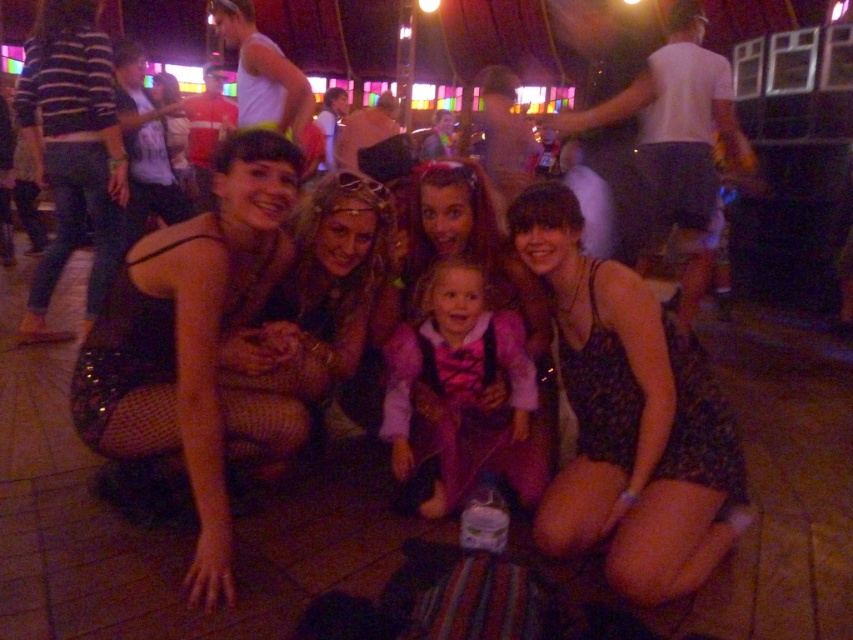
You are a photographer adjusting the camera focus for the group photo. The subjects include the matte black dress at center and the purple velvet dress at center. Which dress should you focus on first to ensure both are in sharp focus?

You should focus on the matte black dress at center first since it is closer to the viewer than the purple velvet dress at center. By focusing on the closer object, the depth of field may naturally include the farther one in acceptable focus.

You are a photographer at the party and want to adjust the lighting to focus on the black floral dress at center and the purple velvet dress at center. Since both dresses are at the center, which one should you adjust the light to be closer to in order to highlight them both effectively?

The black floral dress at center is closer to the viewer than the purple velvet dress at center, so adjusting the light to focus on the black floral dress at center first and then the purple velvet dress at center would ensure both are highlighted effectively.

You are a photographer at the party and need to adjust the lighting to ensure both the matte black dress at center and the purple velvet dress at center are equally illuminated. Given that the purple velvet dress reflects more light, which dress should you focus the light on more to achieve balanced illumination?

Since the purple velvet dress at center reflects more light, you should focus the light more on the matte black dress at center to balance the illumination between both dresses.